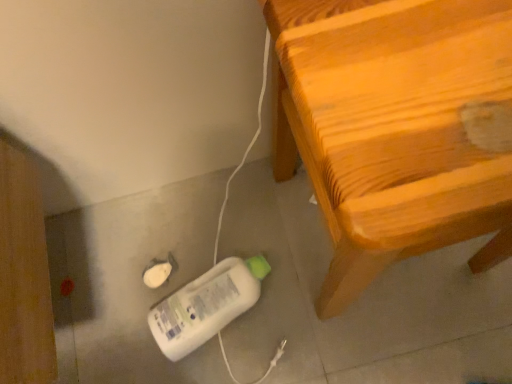
Measure the distance between point (160, 305) and camera.

Point (160, 305) and camera are 77.40 centimeters apart from each other.

The image size is (512, 384). What do you see at coordinates (206, 305) in the screenshot?
I see `white plastic bottle at lower center` at bounding box center [206, 305].

The width and height of the screenshot is (512, 384). In order to click on white plastic bottle at lower center in this screenshot , I will do `click(206, 305)`.

Find the location of a particular element. wooden chair at right is located at coordinates coord(396,127).

The height and width of the screenshot is (384, 512). What do you see at coordinates (396, 127) in the screenshot?
I see `wooden chair at right` at bounding box center [396, 127].

Where is `white plastic bottle at lower center`? Image resolution: width=512 pixels, height=384 pixels. white plastic bottle at lower center is located at coordinates (206, 305).

Which is more to the right, white plastic bottle at lower center or wooden chair at right?

Positioned to the right is wooden chair at right.

Between white plastic bottle at lower center and wooden chair at right, which one is positioned behind?

white plastic bottle at lower center is further away from the camera.

Which is less distant, [174,343] or [463,203]?

Point [174,343] is positioned farther from the camera compared to point [463,203].

From the image's perspective, between white plastic bottle at lower center and wooden chair at right, which one is located above?

From the image's view, wooden chair at right is above.

From a real-world perspective, is white plastic bottle at lower center positioned above or below wooden chair at right?

From a real-world perspective, white plastic bottle at lower center is physically below wooden chair at right.

Considering the sizes of white plastic bottle at lower center and wooden chair at right in the image, is white plastic bottle at lower center wider or thinner than wooden chair at right?

white plastic bottle at lower center is thinner than wooden chair at right.

Considering the sizes of objects white plastic bottle at lower center and wooden chair at right in the image provided, who is taller, white plastic bottle at lower center or wooden chair at right?

wooden chair at right is taller.

Is white plastic bottle at lower center bigger than wooden chair at right?

No, white plastic bottle at lower center is not bigger than wooden chair at right.

Is white plastic bottle at lower center not within wooden chair at right?

Yes.

Is white plastic bottle at lower center placed right next to wooden chair at right?

white plastic bottle at lower center and wooden chair at right are clearly separated.

Is white plastic bottle at lower center facing towards wooden chair at right?

No, white plastic bottle at lower center is not turned towards wooden chair at right.

Can you tell me how much white plastic bottle at lower center and wooden chair at right differ in facing direction?

The angle between the facing direction of white plastic bottle at lower center and the facing direction of wooden chair at right is 0.00104 degrees.

How far apart are white plastic bottle at lower center and wooden chair at right?

white plastic bottle at lower center is 37.29 centimeters from wooden chair at right.

Image resolution: width=512 pixels, height=384 pixels. I want to click on furniture on the right side of white plastic bottle at lower center, so click(x=396, y=127).

Does wooden chair at right appear on the left side of white plastic bottle at lower center?

No.

From the picture: Considering the relative positions of wooden chair at right and white plastic bottle at lower center in the image provided, is wooden chair at right behind white plastic bottle at lower center?

No, wooden chair at right is closer to the camera.

Which is farther, (502, 130) or (246, 307)?

Positioned behind is point (246, 307).

From the image's perspective, is wooden chair at right on white plastic bottle at lower center?

Indeed, from the image's perspective, wooden chair at right is shown above white plastic bottle at lower center.

From a real-world perspective, who is located lower, wooden chair at right or white plastic bottle at lower center?

white plastic bottle at lower center, from a real-world perspective.

Between wooden chair at right and white plastic bottle at lower center, which one has larger width?

wooden chair at right is wider.

Between wooden chair at right and white plastic bottle at lower center, which one has less height?

Standing shorter between the two is white plastic bottle at lower center.

Between wooden chair at right and white plastic bottle at lower center, which one has smaller size?

white plastic bottle at lower center is smaller.

Is white plastic bottle at lower center surrounded by wooden chair at right?

No, white plastic bottle at lower center is not a part of wooden chair at right.

Is wooden chair at right positioned far away from white plastic bottle at lower center?

wooden chair at right is actually quite close to white plastic bottle at lower center.

Is wooden chair at right oriented towards white plastic bottle at lower center?

No, wooden chair at right is not oriented towards white plastic bottle at lower center.

What's the angular difference between wooden chair at right and white plastic bottle at lower center's facing directions?

The facing directions of wooden chair at right and white plastic bottle at lower center are 0.00104 degrees apart.

Where is `furniture in front of the white plastic bottle at lower center`? Image resolution: width=512 pixels, height=384 pixels. furniture in front of the white plastic bottle at lower center is located at coordinates (396, 127).

Image resolution: width=512 pixels, height=384 pixels. I want to click on furniture that appears above the white plastic bottle at lower center (from the image's perspective), so click(x=396, y=127).

I want to click on furniture above the white plastic bottle at lower center (from a real-world perspective), so click(x=396, y=127).